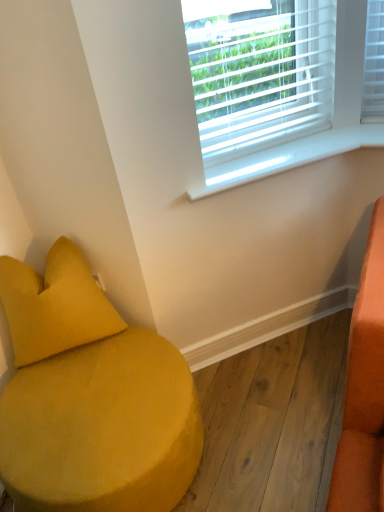
Measure the distance between point (23, 285) and camera.

They are 1.41 meters apart.

Describe the element at coordinates (90, 398) in the screenshot. This screenshot has height=512, width=384. I see `velvet yellow ottoman at lower left` at that location.

What do you see at coordinates (288, 157) in the screenshot? I see `white plastic window sill at upper center` at bounding box center [288, 157].

What are the coordinates of `white plastic blinds at upper center` in the screenshot? It's located at (271, 87).

At what (x,y) coordinates should I click in order to perform the action: click on matte yellow pillow at lower left. Please return your answer as a coordinate pair (x, y). Looking at the image, I should click on (54, 305).

Could you tell me if velvet yellow ottoman at lower left is turned towards white plastic window sill at upper center?

No, velvet yellow ottoman at lower left does not turn towards white plastic window sill at upper center.

Which point is more distant from viewer, (x=108, y=461) or (x=365, y=141)?

Positioned behind is point (x=365, y=141).

Is velvet yellow ottoman at lower left positioned before white plastic window sill at upper center?

Yes, it is.

Based on their sizes in the image, would you say matte yellow pillow at lower left is bigger or smaller than velvet yellow ottoman at lower left?

Clearly, matte yellow pillow at lower left is smaller in size than velvet yellow ottoman at lower left.

From the image's perspective, between matte yellow pillow at lower left and velvet yellow ottoman at lower left, who is located below?

velvet yellow ottoman at lower left, from the image's perspective.

Who is taller, matte yellow pillow at lower left or velvet yellow ottoman at lower left?

matte yellow pillow at lower left.

Which object is closer to the camera, matte yellow pillow at lower left or velvet yellow ottoman at lower left?

velvet yellow ottoman at lower left is in front.

Which of these two, white plastic blinds at upper center or white plastic window sill at upper center, stands taller?

white plastic blinds at upper center.

Between white plastic blinds at upper center and white plastic window sill at upper center, which one appears on the right side from the viewer's perspective?

white plastic window sill at upper center is more to the right.

The height and width of the screenshot is (512, 384). Find the location of `window sill located behind the white plastic blinds at upper center`. window sill located behind the white plastic blinds at upper center is located at coordinates (288, 157).

Could you tell me if white plastic blinds at upper center is turned towards white plastic window sill at upper center?

No, white plastic blinds at upper center is not facing towards white plastic window sill at upper center.

Where is `window above the velvet yellow ottoman at lower left (from a real-world perspective)`? The image size is (384, 512). window above the velvet yellow ottoman at lower left (from a real-world perspective) is located at coordinates (271, 87).

From the picture: Which object is positioned more to the right, velvet yellow ottoman at lower left or white plastic blinds at upper center?

From the viewer's perspective, white plastic blinds at upper center appears more on the right side.

Can you confirm if velvet yellow ottoman at lower left is taller than white plastic blinds at upper center?

No, velvet yellow ottoman at lower left is not taller than white plastic blinds at upper center.

From a real-world perspective, is velvet yellow ottoman at lower left physically below white plastic blinds at upper center?

Yes, from a real-world perspective, velvet yellow ottoman at lower left is below white plastic blinds at upper center.

The height and width of the screenshot is (512, 384). What are the coordinates of `window sill above the velvet yellow ottoman at lower left (from the image's perspective)` in the screenshot? It's located at (288, 157).

Considering the sizes of white plastic window sill at upper center and velvet yellow ottoman at lower left in the image, is white plastic window sill at upper center wider or thinner than velvet yellow ottoman at lower left?

Considering their sizes, white plastic window sill at upper center looks slimmer than velvet yellow ottoman at lower left.

From a real-world perspective, is white plastic window sill at upper center on velvet yellow ottoman at lower left?

Yes, from a real-world perspective, white plastic window sill at upper center is over velvet yellow ottoman at lower left

Based on the photo, from the image's perspective, who appears lower, white plastic window sill at upper center or velvet yellow ottoman at lower left?

velvet yellow ottoman at lower left, from the image's perspective.

Which is in front, white plastic blinds at upper center or matte yellow pillow at lower left?

A: matte yellow pillow at lower left is more forward.

Based on the photo, is white plastic blinds at upper center aimed at matte yellow pillow at lower left?

No, white plastic blinds at upper center is not turned towards matte yellow pillow at lower left.

Is white plastic blinds at upper center taller than matte yellow pillow at lower left?

Yes.

Which point is more forward, (370, 143) or (170, 347)?

Positioned in front is point (170, 347).

Considering the sizes of objects white plastic blinds at upper center and velvet yellow ottoman at lower left in the image provided, who is bigger, white plastic blinds at upper center or velvet yellow ottoman at lower left?

With larger size is velvet yellow ottoman at lower left.

Is white plastic blinds at upper center thinner than velvet yellow ottoman at lower left?

Yes.

Is white plastic blinds at upper center located outside velvet yellow ottoman at lower left?

Absolutely, white plastic blinds at upper center is external to velvet yellow ottoman at lower left.

Identify the location of furniture that appears on the left of white plastic window sill at upper center. The width and height of the screenshot is (384, 512). (90, 398).

This screenshot has width=384, height=512. In the image, there is a matte yellow pillow at lower left. In order to click on furniture below it (from the image's perspective) in this screenshot , I will do [x=90, y=398].

Estimate the real-world distances between objects in this image. Which object is further from velvet yellow ottoman at lower left, white plastic window sill at upper center or white plastic blinds at upper center?

The object further to velvet yellow ottoman at lower left is white plastic blinds at upper center.

Estimate the real-world distances between objects in this image. Which object is closer to matte yellow pillow at lower left, velvet yellow ottoman at lower left or white plastic window sill at upper center?

Based on the image, velvet yellow ottoman at lower left appears to be nearer to matte yellow pillow at lower left.

From the picture: Considering their positions, is matte yellow pillow at lower left positioned closer to white plastic window sill at upper center than velvet yellow ottoman at lower left?

Based on the image, matte yellow pillow at lower left appears to be nearer to white plastic window sill at upper center.

Which object lies nearer to the anchor point white plastic blinds at upper center, matte yellow pillow at lower left or velvet yellow ottoman at lower left?

matte yellow pillow at lower left is closer to white plastic blinds at upper center.

Looking at the image, which one is located further to matte yellow pillow at lower left, velvet yellow ottoman at lower left or white plastic blinds at upper center?

Among the two, white plastic blinds at upper center is located further to matte yellow pillow at lower left.

When comparing their distances from white plastic window sill at upper center, does velvet yellow ottoman at lower left or matte yellow pillow at lower left seem further?

The object further to white plastic window sill at upper center is velvet yellow ottoman at lower left.

When comparing their distances from white plastic window sill at upper center, does velvet yellow ottoman at lower left or white plastic blinds at upper center seem closer?

white plastic blinds at upper center is closer to white plastic window sill at upper center.

Looking at the image, which one is located further to velvet yellow ottoman at lower left, matte yellow pillow at lower left or white plastic blinds at upper center?

Based on the image, white plastic blinds at upper center appears to be further to velvet yellow ottoman at lower left.

The height and width of the screenshot is (512, 384). Identify the location of pillow that lies between white plastic blinds at upper center and velvet yellow ottoman at lower left from top to bottom. point(54,305).

Identify the location of window sill between white plastic blinds at upper center and velvet yellow ottoman at lower left from top to bottom. (288, 157).

This screenshot has height=512, width=384. I want to click on pillow between white plastic window sill at upper center and velvet yellow ottoman at lower left in the vertical direction, so click(54, 305).

What are the coordinates of `window between matte yellow pillow at lower left and white plastic window sill at upper center from left to right` in the screenshot? It's located at (271, 87).